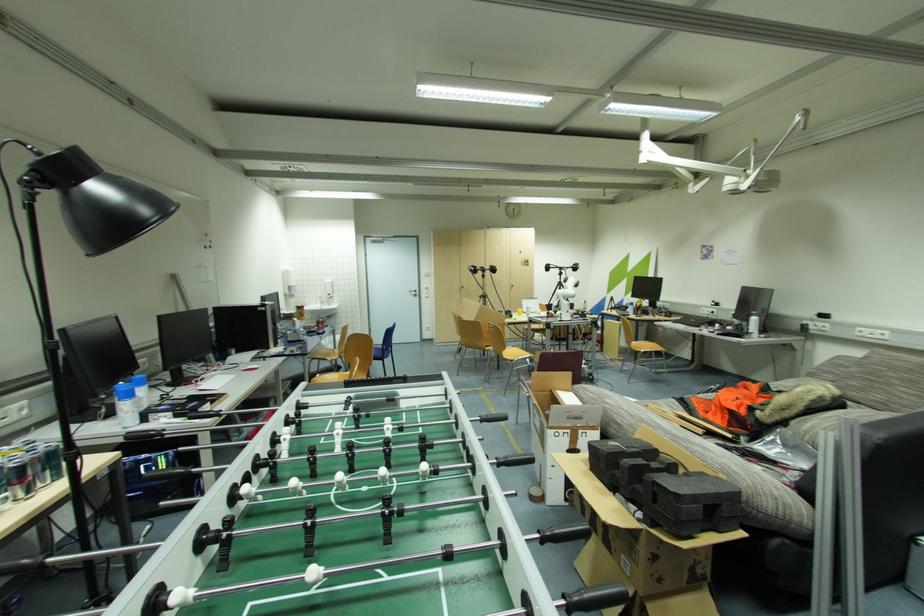
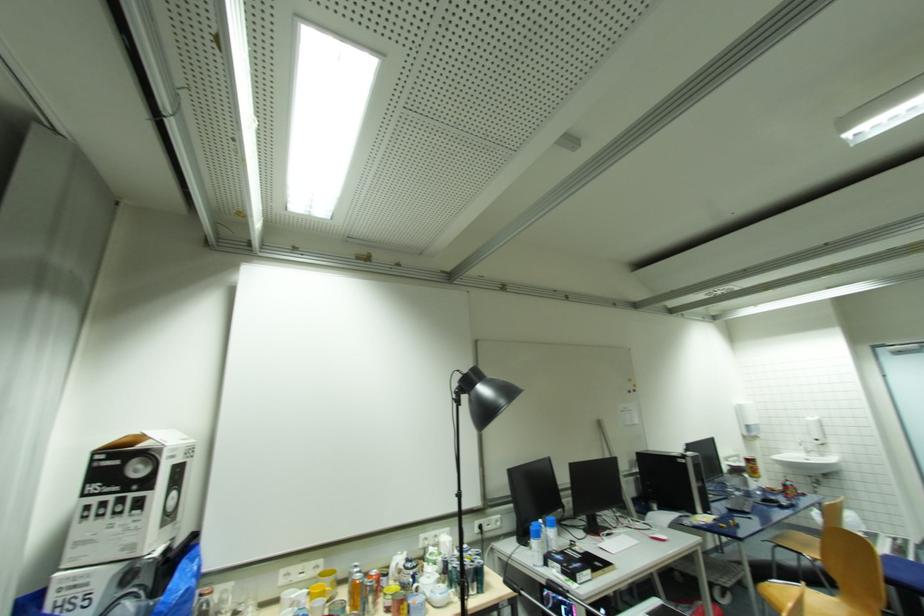
The images are taken continuously from a first-person perspective. In which direction is your viewpoint rotating?

The rotation direction of the camera is left-up.